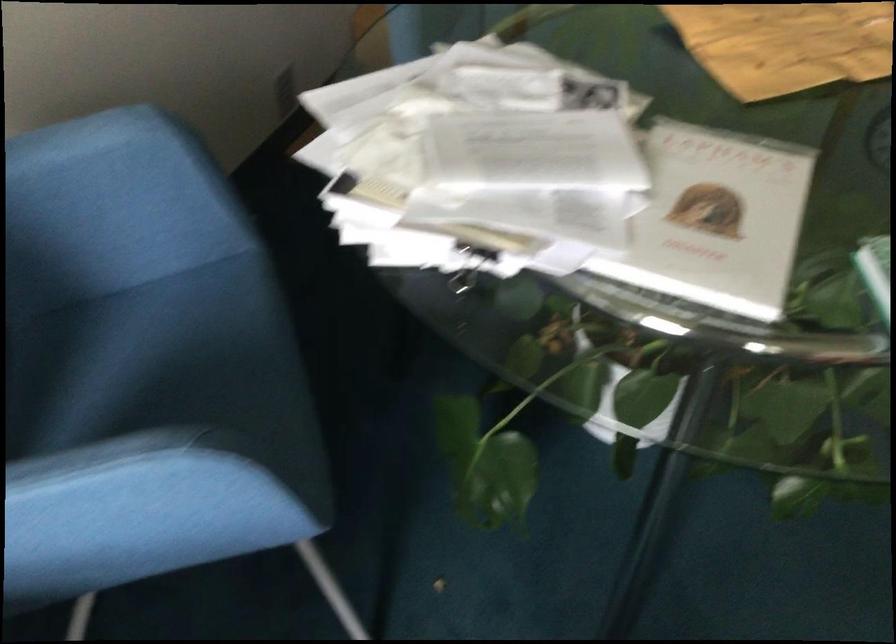
Where would you lift the brown envelope? Please return your answer as a coordinate pair (x, y).

(786, 44)